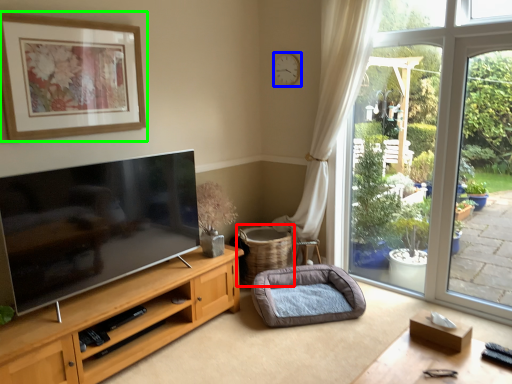
Question: Considering the real-world distances, which object is farthest from basket (highlighted by a red box)? clock (highlighted by a blue box) or picture frame (highlighted by a green box)?

Choices:
 (A) clock
 (B) picture frame

Answer: (B)